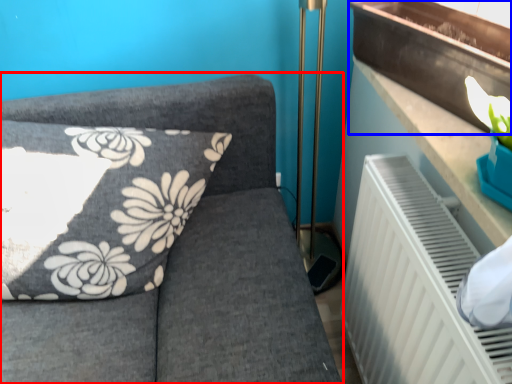
Question: Among these objects, which one is farthest to the camera, furniture (highlighted by a red box) or window sill (highlighted by a blue box)?

Choices:
 (A) furniture
 (B) window sill

Answer: (A)